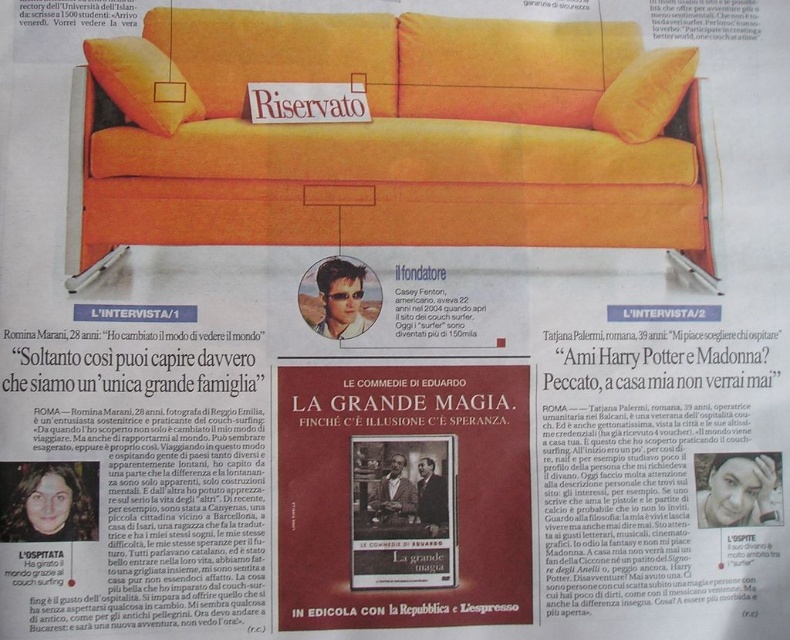
Question: Which point is farther to the camera?

Choices:
 (A) matte orange pillow at upper left
 (B) orange fabric couch at upper center
 (C) orange fabric pillow at upper right

Answer: (C)

Question: From the image, what is the correct spatial relationship of matte orange pillow at upper left in relation to orange fabric pillow at upper right?

Choices:
 (A) above
 (B) below

Answer: (B)

Question: Among these objects, which one is nearest to the camera?

Choices:
 (A) orange fabric pillow at upper right
 (B) matte orange pillow at upper left
 (C) orange fabric couch at upper center

Answer: (C)

Question: Does orange fabric couch at upper center appear over orange fabric pillow at upper right?

Choices:
 (A) yes
 (B) no

Answer: (B)

Question: Which object is positioned farthest from the orange fabric couch at upper center?

Choices:
 (A) orange fabric pillow at upper right
 (B) matte orange pillow at upper left

Answer: (A)

Question: Does orange fabric couch at upper center lie behind matte orange pillow at upper left?

Choices:
 (A) no
 (B) yes

Answer: (A)